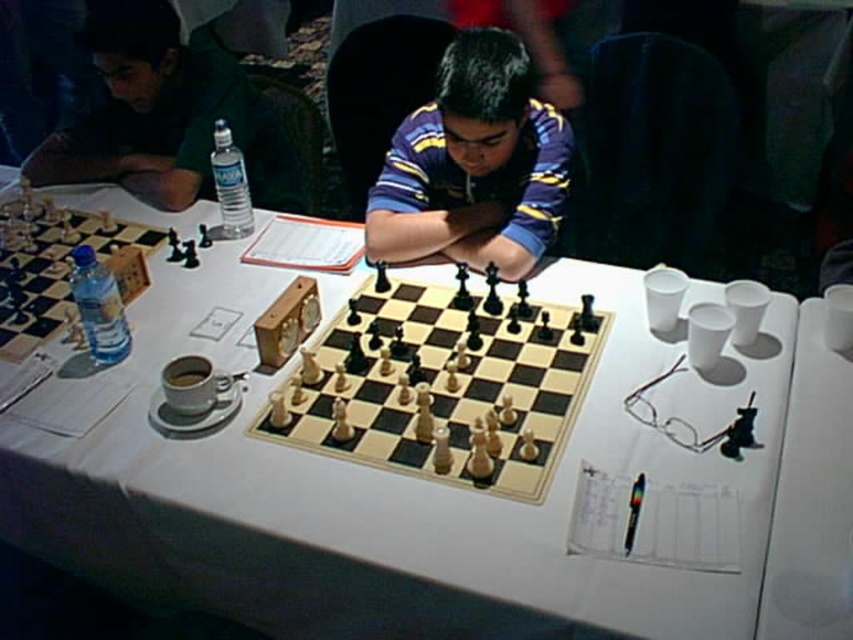
Between wooden chess set at center and matte green shirt at upper left, which one has less height?

wooden chess set at center is shorter.

Where is `wooden chess set at center`? This screenshot has height=640, width=853. wooden chess set at center is located at coordinates (442, 387).

Is point (538, 314) less distant than point (44, 173)?

Yes, it is in front of point (44, 173).

Find the location of `wooden chess set at center`. wooden chess set at center is located at coordinates pos(442,387).

Can you confirm if matte green shirt at upper left is thinner than clear plastic bottle at left?

Incorrect, matte green shirt at upper left's width is not less than clear plastic bottle at left's.

Is matte green shirt at upper left to the right of clear plastic bottle at left from the viewer's perspective?

Indeed, matte green shirt at upper left is positioned on the right side of clear plastic bottle at left.

At what (x,y) coordinates should I click in order to perform the action: click on matte green shirt at upper left. Please return your answer as a coordinate pair (x, y). Looking at the image, I should click on (165, 115).

Can you confirm if white glossy table at center is shorter than clear plastic bottle at center?

No, white glossy table at center is not shorter than clear plastic bottle at center.

Is white glossy table at center closer to camera compared to clear plastic bottle at center?

Yes, it is.

You are a GUI agent. You are given a task and a screenshot of the screen. Output one action in this format:
    pyautogui.click(x=<x>, y=<y>)
    Task: Click on the white glossy table at center
    
    Given the screenshot: What is the action you would take?
    pyautogui.click(x=383, y=492)